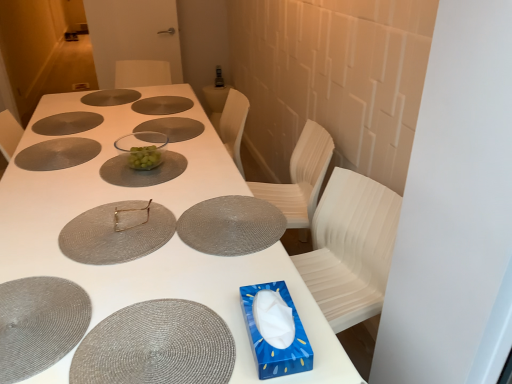
Find the location of a particular element. vacant space to the right of matte silver fork at center is located at coordinates (191, 213).